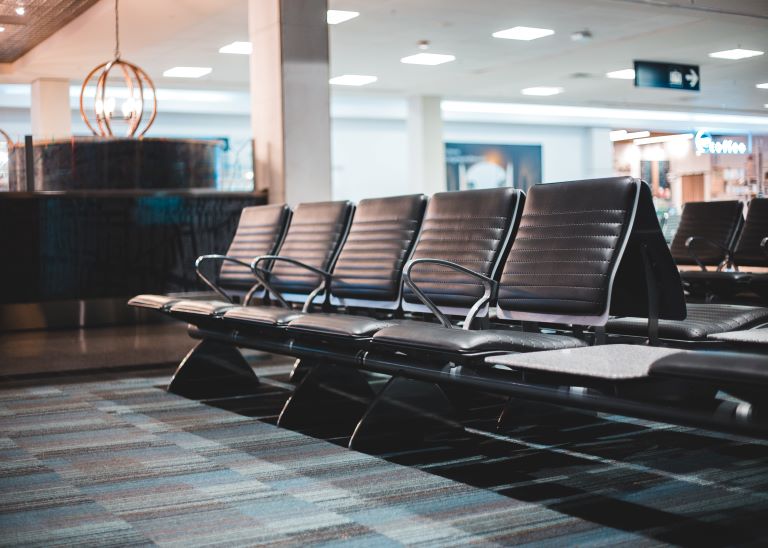
Identify the location of square lights. Image resolution: width=768 pixels, height=548 pixels. (520, 35).